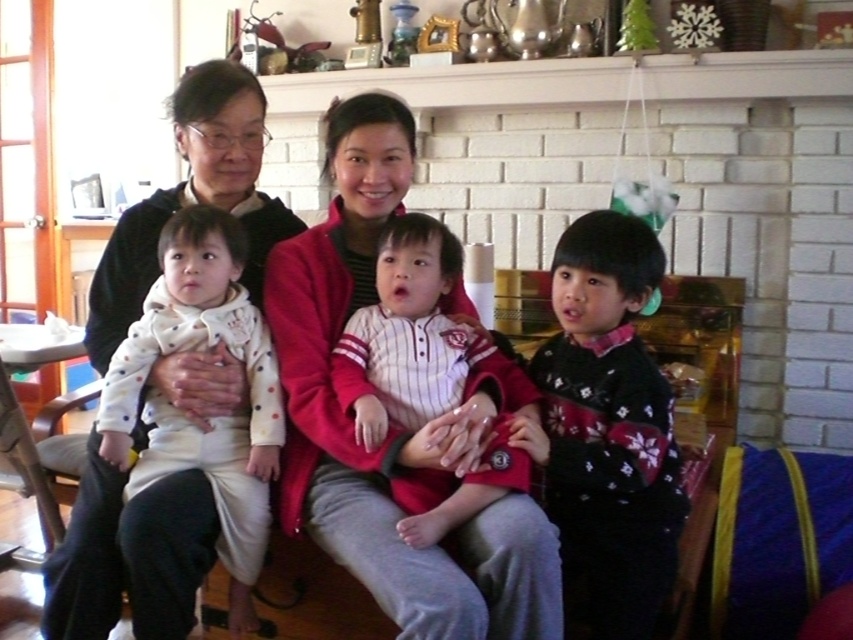
You are organizing a gift wrapping station in the living room and need to place the knitted sweater at right and the white dotted fabric baby at left on a shelf. Which item requires more shelf space?

The white dotted fabric baby at left requires more shelf space because the knitted sweater at right occupies less space than it.